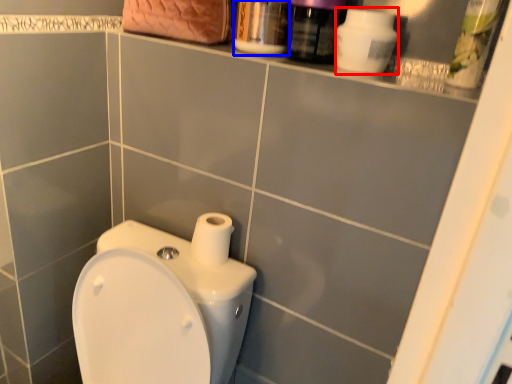
Question: Which object is further to the camera taking this photo, cleaning product (highlighted by a red box) or mouthwash (highlighted by a blue box)?

Choices:
 (A) cleaning product
 (B) mouthwash

Answer: (B)